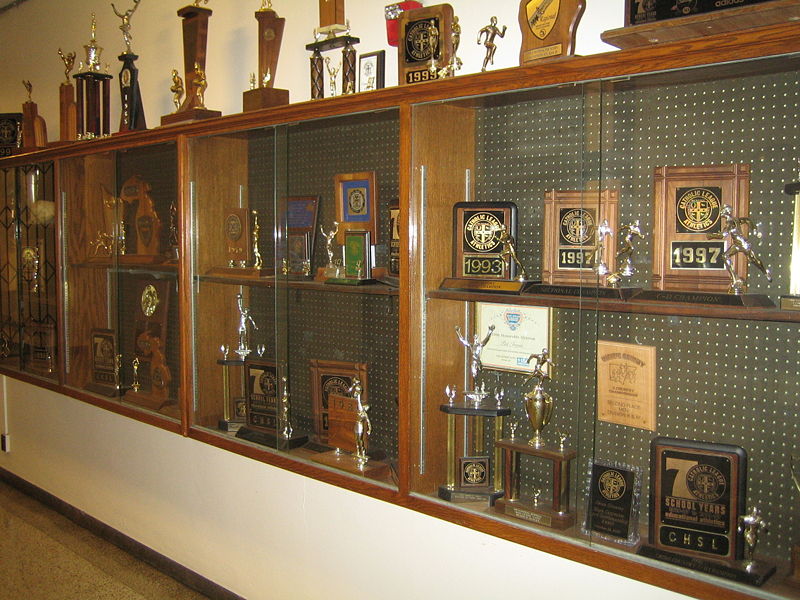
Image resolution: width=800 pixels, height=600 pixels. What are the coordinates of `white wall` in the screenshot? It's located at (256, 492).